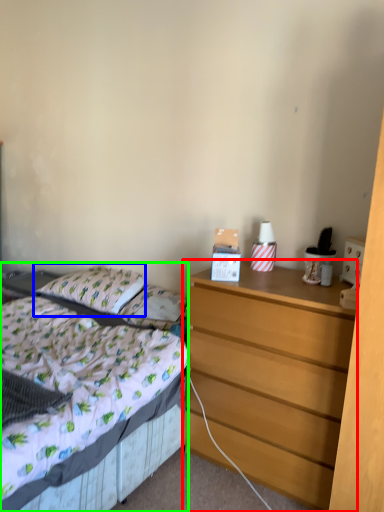
Question: Which object is the farthest from chest of drawers (highlighted by a red box)? Choose among these: pillow (highlighted by a blue box) or bed (highlighted by a green box).

Choices:
 (A) pillow
 (B) bed

Answer: (A)